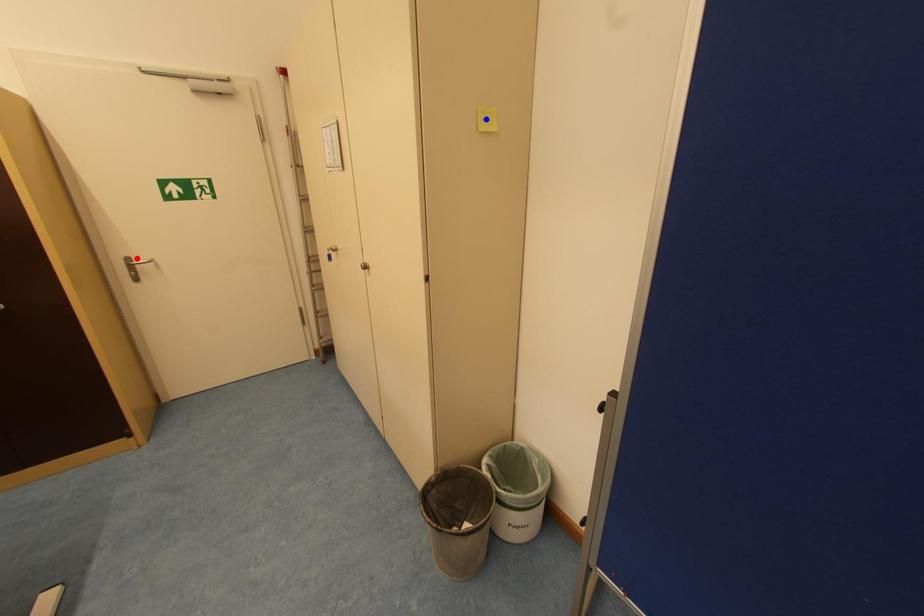
Question: Which of the two points in the image is closer to the camera?

Choices:
 (A) Blue point is closer.
 (B) Red point is closer.

Answer: (A)